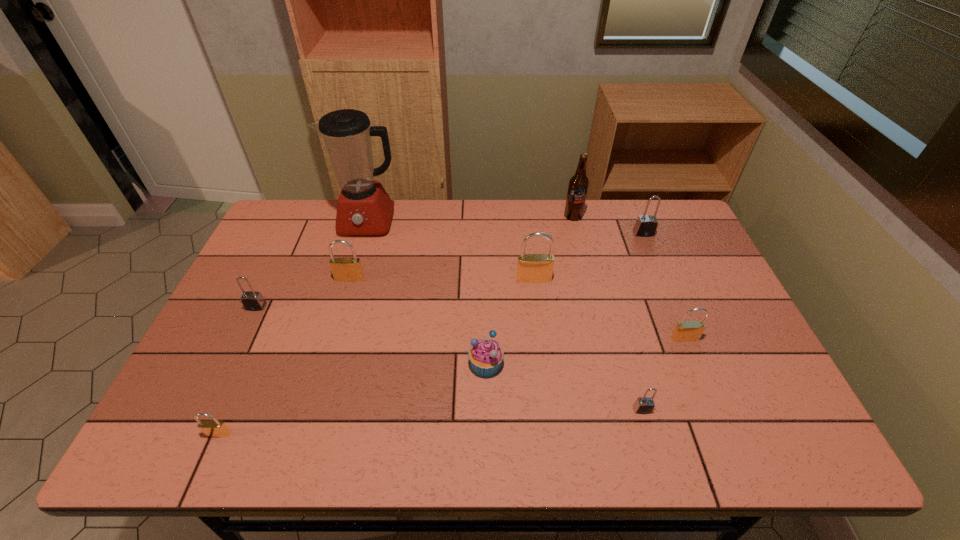
At what (x,y) coordinates should I click in order to perform the action: click on object at the near edge. Please return your answer as a coordinate pair (x, y). Looking at the image, I should click on point(215,428).

At what (x,y) coordinates should I click in order to perform the action: click on object at the near left corner. Please return your answer as a coordinate pair (x, y). Looking at the image, I should click on (215, 428).

You are a GUI agent. You are given a task and a screenshot of the screen. Output one action in this format:
    pyautogui.click(x=<x>, y=<y>)
    Task: Click on the object at the far right corner
    
    Given the screenshot: What is the action you would take?
    pyautogui.click(x=646, y=225)

You are a GUI agent. You are given a task and a screenshot of the screen. Output one action in this format:
    pyautogui.click(x=<x>, y=<y>)
    Task: Click on the free spot at the far edge of the desktop
    The height and width of the screenshot is (540, 960).
    Given the screenshot: What is the action you would take?
    pyautogui.click(x=494, y=234)

I want to click on blank space at the left edge of the desktop, so click(276, 271).

The height and width of the screenshot is (540, 960). I want to click on vacant space at the right edge, so click(x=678, y=274).

The width and height of the screenshot is (960, 540). What are the coordinates of `free space at the far right corner of the desktop` in the screenshot? It's located at (673, 210).

Where is `empty space that is in between the third smallest brass padlock and the farthest padlock`? The image size is (960, 540). empty space that is in between the third smallest brass padlock and the farthest padlock is located at coordinates (496, 256).

This screenshot has width=960, height=540. Find the location of `free spot between the farthest padlock and the second nearest brass padlock`. free spot between the farthest padlock and the second nearest brass padlock is located at coordinates (664, 286).

The image size is (960, 540). Identify the location of free area in between the fifth padlock from left to right and the third biggest brass padlock. (663, 374).